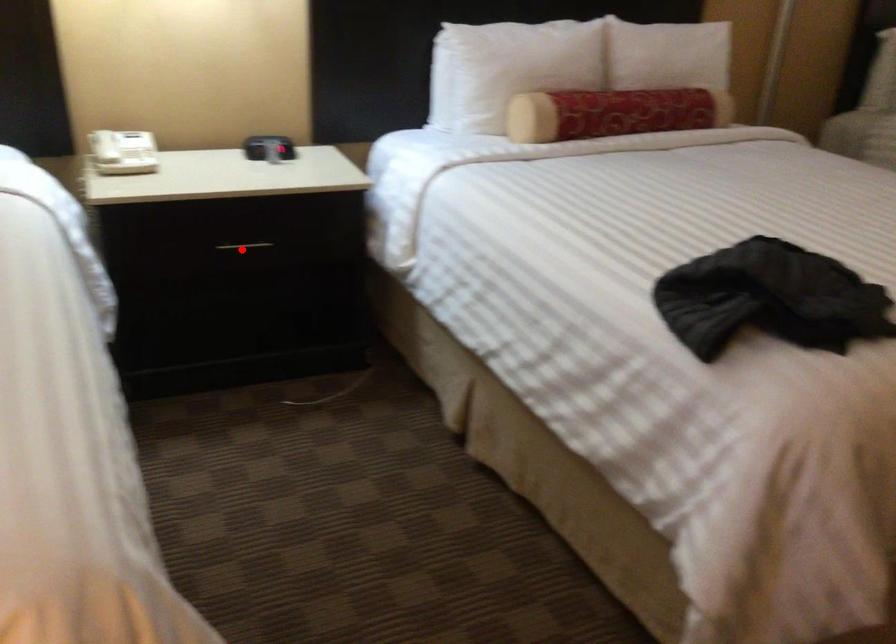
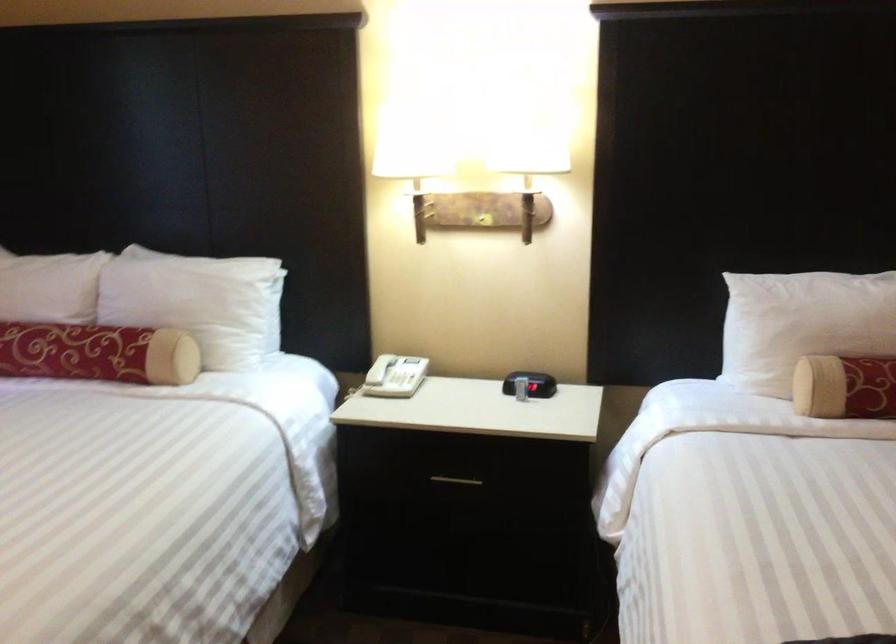
Find the pixel in the second image that matches the highlighted location in the first image.

(455, 480)